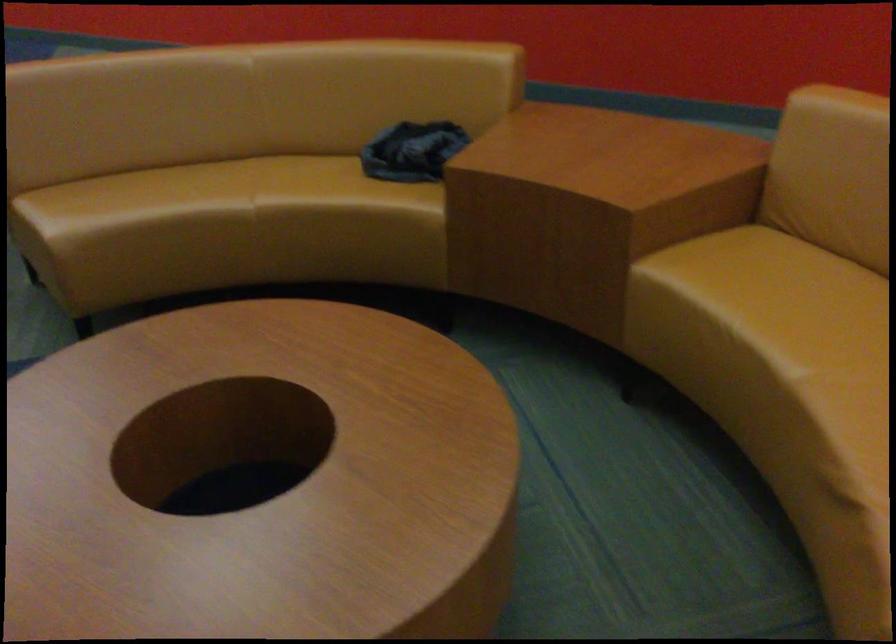
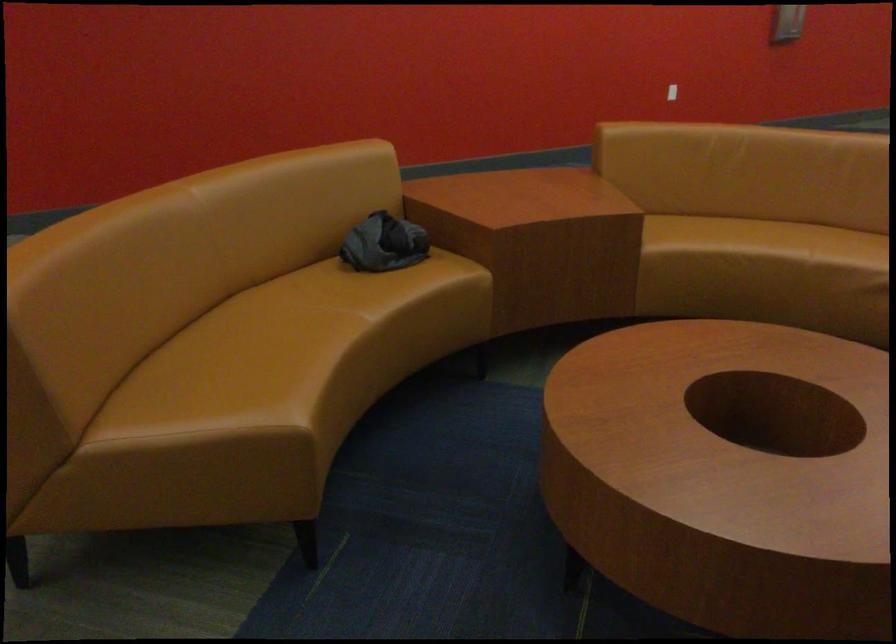
Locate, in the second image, the point that corresponds to point (380, 146) in the first image.

(383, 243)